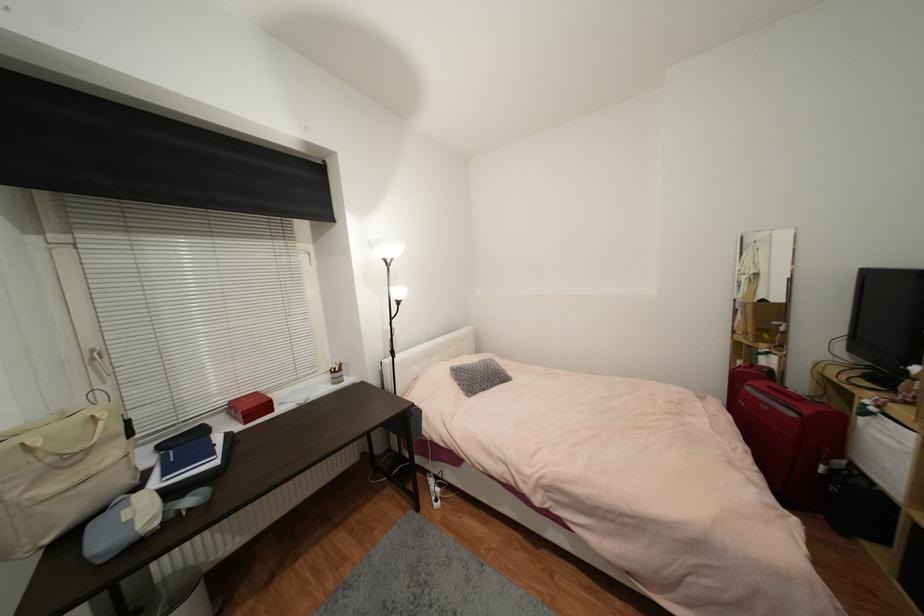
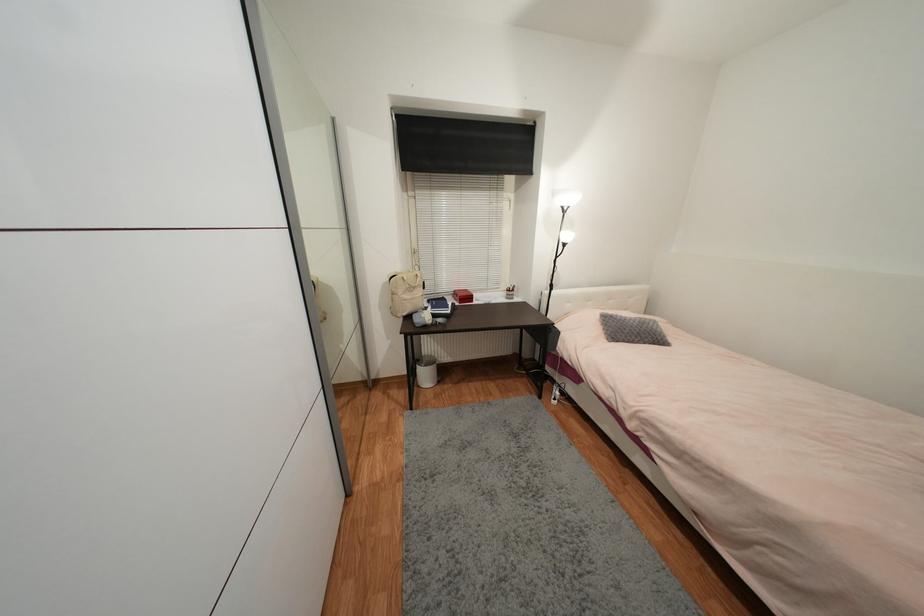
Find the pixel in the second image that matches point (487, 371) in the first image.

(639, 326)